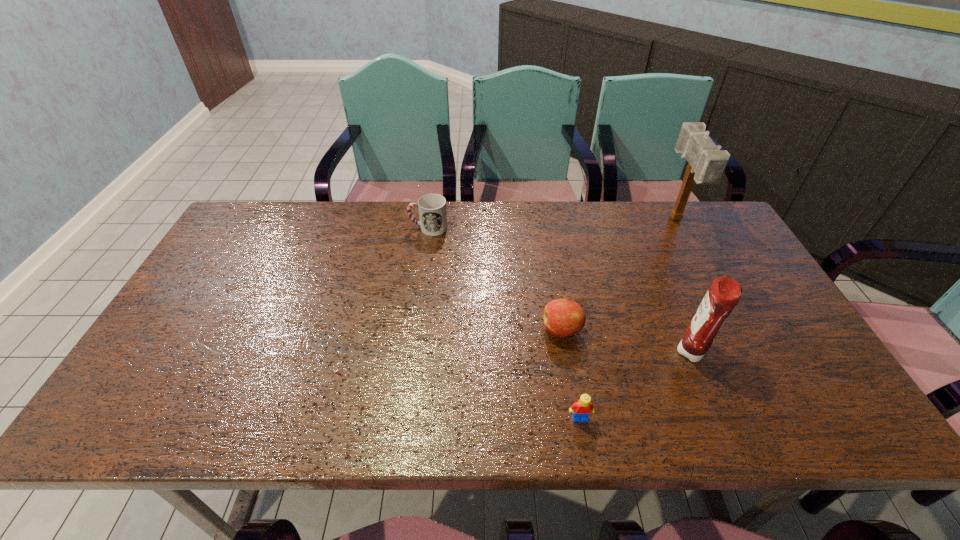
I want to click on vacant position located on the side of the cup where the handle is located, so click(x=391, y=227).

The image size is (960, 540). I want to click on free space located on the side of the cup where the handle is located, so click(x=304, y=227).

Where is `vacant space situated on the front of the apple`? vacant space situated on the front of the apple is located at coordinates (571, 387).

Where is `mallet at the far edge`? This screenshot has width=960, height=540. mallet at the far edge is located at coordinates (707, 162).

Identify the location of cup that is at the far edge. (432, 207).

You are a GUI agent. You are given a task and a screenshot of the screen. Output one action in this format:
    pyautogui.click(x=<x>, y=<y>)
    Task: Click on the object that is at the near edge
    
    Given the screenshot: What is the action you would take?
    pyautogui.click(x=582, y=408)

Image resolution: width=960 pixels, height=540 pixels. I want to click on object that is at the right edge, so click(707, 162).

Locate an element on the screen. The width and height of the screenshot is (960, 540). object that is at the far right corner is located at coordinates (707, 162).

I want to click on free region at the far edge of the desktop, so click(x=490, y=204).

Locate an element on the screen. This screenshot has width=960, height=540. blank space at the near edge of the desktop is located at coordinates (340, 407).